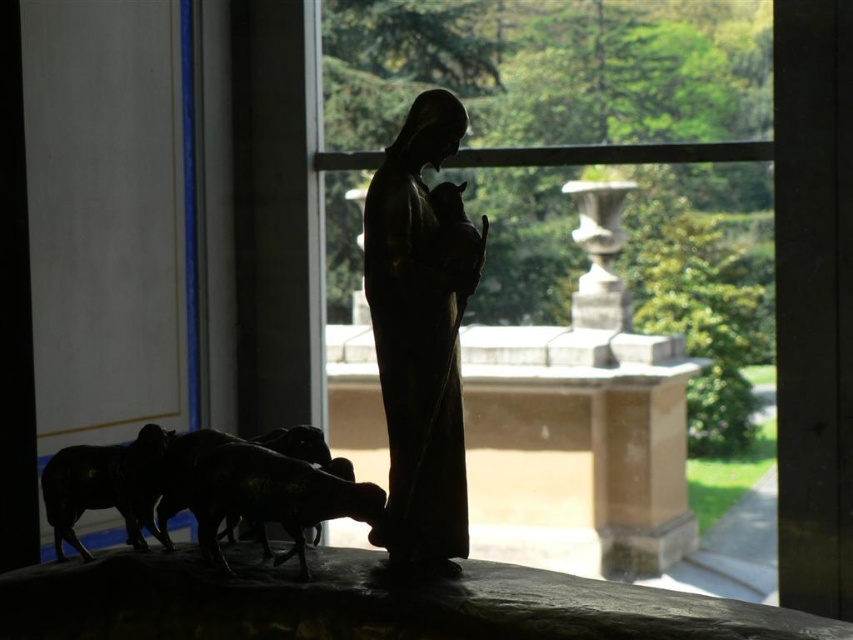
Question: Which of these objects is positioned closest to the transparent glass window at center?

Choices:
 (A) shiny black sheep at lower left
 (B) dark matte metal sheep at lower left

Answer: (B)

Question: Is transparent glass window at center behind shiny black sheep at lower left?

Choices:
 (A) no
 (B) yes

Answer: (B)

Question: Which object is the closest to the matte black statue at center?

Choices:
 (A) transparent glass window at center
 (B) dark matte metal sheep at lower left

Answer: (B)

Question: Is transparent glass window at center positioned at the back of dark matte metal sheep at lower left?

Choices:
 (A) no
 (B) yes

Answer: (B)

Question: Which point is farther to the camera?

Choices:
 (A) dark matte metal sheep at lower left
 (B) matte black statue at center
 (C) transparent glass window at center
 (D) shiny black sheep at lower left

Answer: (C)

Question: Can you confirm if dark matte metal sheep at lower left is thinner than shiny black sheep at lower left?

Choices:
 (A) no
 (B) yes

Answer: (A)